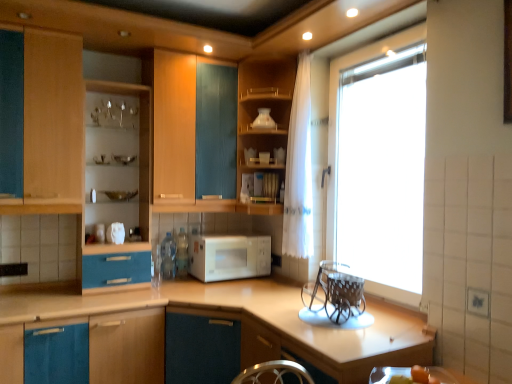
Question: Is clear glass basket at right, arranged as the 1th appliance when viewed from the right, spatially inside wooden cabinet at upper center, which appears as the 1th cabinetry when viewed from the right, or outside of it?

Choices:
 (A) outside
 (B) inside

Answer: (A)

Question: Is clear glass basket at right, arranged as the 1th appliance when viewed from the right, taller or shorter than wooden cabinet at upper center, which appears as the 1th cabinetry when viewed from the right?

Choices:
 (A) short
 (B) tall

Answer: (A)

Question: Estimate the real-world distances between objects in this image. Which object is closer to the wooden cabinet at upper center, marked as the third cabinetry in a left-to-right arrangement?

Choices:
 (A) white matte microwave at center
 (B) white sheer curtain at right
 (C) clear glass basket at right, positioned as the second appliance in back-to-front order
 (D) white glossy vase at upper center, which is the first appliance from left to right
 (E) transparent glass window at upper right

Answer: (D)

Question: Which of these objects is positioned closest to the blue matte cabinet at lower left, the first cabinetry viewed from the left?

Choices:
 (A) white sheer curtain at right
 (B) transparent glass window at upper right
 (C) white matte microwave at center
 (D) matte wood shelves at center, which ranks as the second cabinetry in right-to-left order
 (E) wooden cabinet at upper center, marked as the third cabinetry in a left-to-right arrangement

Answer: (C)